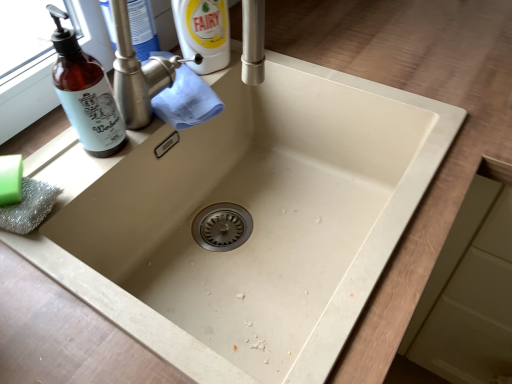
Find the location of `free space to the right of green matte soap at lower left`. free space to the right of green matte soap at lower left is located at coordinates (98, 166).